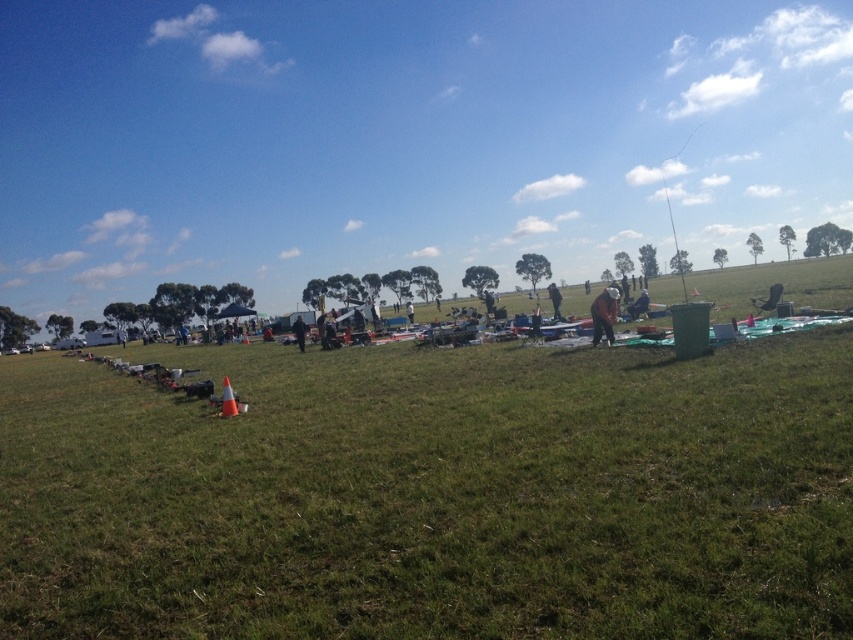
In the scene shown: Between green grass at center and dark blue jacket at center, which one appears on the left side from the viewer's perspective?

dark blue jacket at center

Based on the photo, which is above, green grass at center or dark blue jacket at center?

dark blue jacket at center

Where is `green grass at center`? green grass at center is located at coordinates (433, 493).

Find the location of `green grass at center`. green grass at center is located at coordinates (433, 493).

Measure the distance between green grass at center and brown leather jacket at center-right.

The distance of green grass at center from brown leather jacket at center-right is 50.55 feet.

Between green grass at center and brown leather jacket at center-right, which one is positioned higher?

brown leather jacket at center-right is above.

Between point (334, 401) and point (552, 301), which one is positioned in front?

Point (334, 401) is more forward.

What are the coordinates of `green grass at center` in the screenshot? It's located at (433, 493).

Does dark gray fabric jacket at right appear under brown leather jacket at center-right?

Indeed, dark gray fabric jacket at right is positioned under brown leather jacket at center-right.

Measure the distance between dark gray fabric jacket at right and camera.

dark gray fabric jacket at right and camera are 13.66 meters apart from each other.

Does point (612, 336) come closer to viewer compared to point (552, 292)?

Yes, it is in front of point (552, 292).

This screenshot has width=853, height=640. Find the location of `dark gray fabric jacket at right`. dark gray fabric jacket at right is located at coordinates (604, 314).